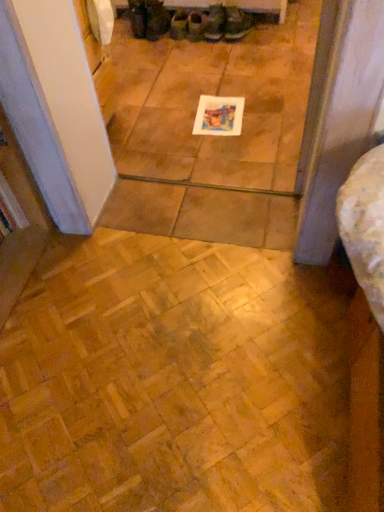
I want to click on free spot below white paper at center (from a real-world perspective), so click(223, 118).